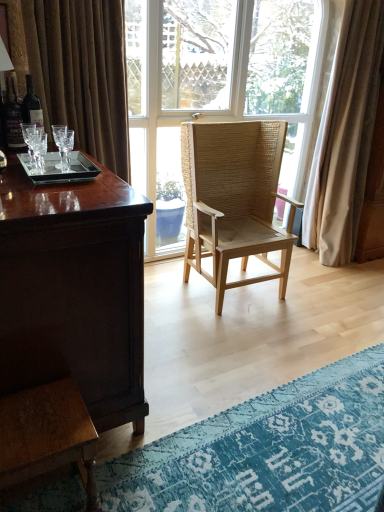
Question: Can we say shiny brown wood desk at left lies outside natural woven wood chair at center?

Choices:
 (A) no
 (B) yes

Answer: (B)

Question: Is shiny brown wood desk at left placed right next to natural woven wood chair at center?

Choices:
 (A) yes
 (B) no

Answer: (B)

Question: Considering the relative sizes of shiny brown wood desk at left and natural woven wood chair at center in the image provided, is shiny brown wood desk at left smaller than natural woven wood chair at center?

Choices:
 (A) yes
 (B) no

Answer: (B)

Question: Is shiny brown wood desk at left wider than natural woven wood chair at center?

Choices:
 (A) no
 (B) yes

Answer: (A)

Question: Considering the relative positions of shiny brown wood desk at left and natural woven wood chair at center in the image provided, is shiny brown wood desk at left behind natural woven wood chair at center?

Choices:
 (A) yes
 (B) no

Answer: (B)

Question: In terms of height, does dark glass bottle at left look taller or shorter compared to beige fabric curtain at right?

Choices:
 (A) tall
 (B) short

Answer: (B)

Question: From the image's perspective, is dark glass bottle at left located above or below beige fabric curtain at right?

Choices:
 (A) below
 (B) above

Answer: (A)

Question: From a real-world perspective, is dark glass bottle at left above or below beige fabric curtain at right?

Choices:
 (A) above
 (B) below

Answer: (A)

Question: Is point (26, 93) closer or farther from the camera than point (334, 96)?

Choices:
 (A) closer
 (B) farther

Answer: (A)

Question: Considering the positions of blue textured rug at lower right and natural woven wood chair at center in the image, is blue textured rug at lower right wider or thinner than natural woven wood chair at center?

Choices:
 (A) wide
 (B) thin

Answer: (A)

Question: From their relative heights in the image, would you say blue textured rug at lower right is taller or shorter than natural woven wood chair at center?

Choices:
 (A) tall
 (B) short

Answer: (B)

Question: Is blue textured rug at lower right spatially inside natural woven wood chair at center, or outside of it?

Choices:
 (A) inside
 (B) outside

Answer: (B)

Question: Considering their positions, is blue textured rug at lower right located in front of or behind natural woven wood chair at center?

Choices:
 (A) behind
 (B) front

Answer: (B)

Question: Would you say beige fabric curtain at right is to the left or to the right of shiny brown wood desk at left in the picture?

Choices:
 (A) left
 (B) right

Answer: (B)

Question: In terms of size, does beige fabric curtain at right appear bigger or smaller than shiny brown wood desk at left?

Choices:
 (A) big
 (B) small

Answer: (B)